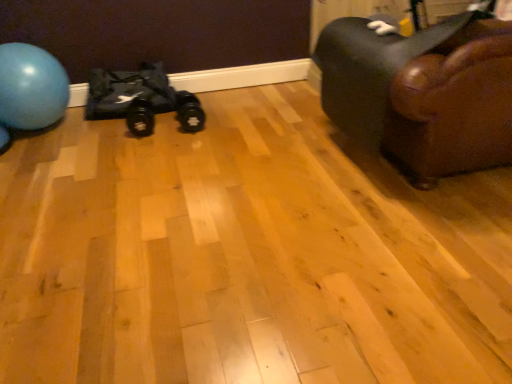
Question: Considering the relative sizes of brown leather couch at right and black rubber dumbbell at center, which is the 1th footwear from right to left, in the image provided, is brown leather couch at right shorter than black rubber dumbbell at center, which is the 1th footwear from right to left,?

Choices:
 (A) yes
 (B) no

Answer: (B)

Question: From a real-world perspective, is brown leather couch at right on black rubber dumbbell at center, the second footwear from the left?

Choices:
 (A) no
 (B) yes

Answer: (B)

Question: Is brown leather couch at right touching black rubber dumbbell at center, which is the 1th footwear from right to left?

Choices:
 (A) no
 (B) yes

Answer: (A)

Question: Can you confirm if brown leather couch at right is positioned to the left of black rubber dumbbell at center, the second footwear from the left?

Choices:
 (A) yes
 (B) no

Answer: (B)

Question: Is brown leather couch at right bigger than black rubber dumbbell at center, the second footwear from the left?

Choices:
 (A) no
 (B) yes

Answer: (B)

Question: Is brown leather couch at right oriented away from black rubber dumbbell at center, the second footwear from the left?

Choices:
 (A) yes
 (B) no

Answer: (B)

Question: Is blue rubber ball at left thinner than brown leather couch at right?

Choices:
 (A) no
 (B) yes

Answer: (B)

Question: Are blue rubber ball at left and brown leather couch at right located far from each other?

Choices:
 (A) yes
 (B) no

Answer: (A)

Question: From the image's perspective, is blue rubber ball at left under brown leather couch at right?

Choices:
 (A) yes
 (B) no

Answer: (B)

Question: Considering the relative sizes of blue rubber ball at left and brown leather couch at right in the image provided, is blue rubber ball at left smaller than brown leather couch at right?

Choices:
 (A) yes
 (B) no

Answer: (A)

Question: Is blue rubber ball at left at the left side of brown leather couch at right?

Choices:
 (A) yes
 (B) no

Answer: (A)

Question: Is blue rubber ball at left positioned with its back to brown leather couch at right?

Choices:
 (A) yes
 (B) no

Answer: (B)

Question: From the image's perspective, would you say black fabric bag at left is positioned over blue rubber ball at left?

Choices:
 (A) yes
 (B) no

Answer: (A)